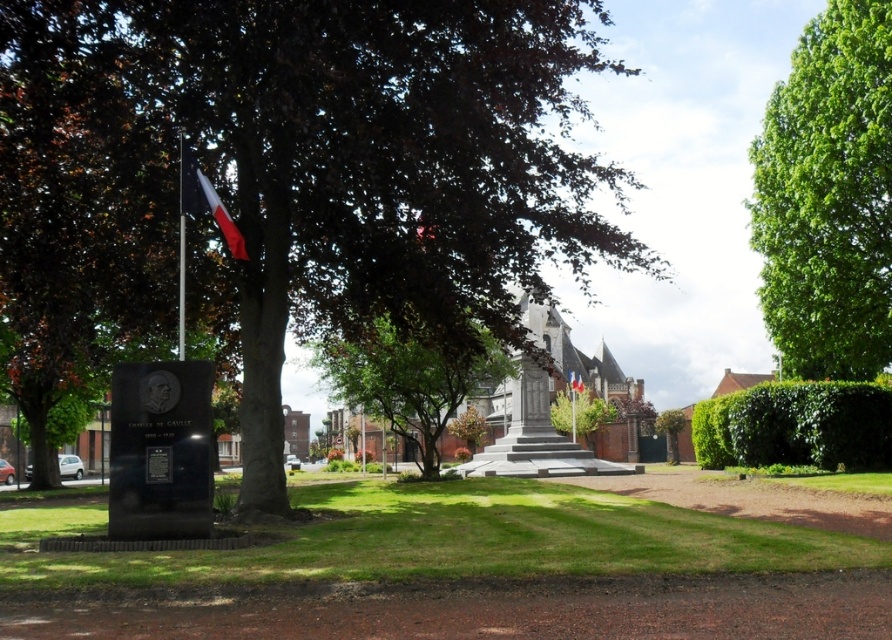
You are a park visitor who wants to take a photo of both the polished red flag at left and the red fabric flag at center. Which flag should you stand closer to in order to capture both in the same frame?

To capture both the polished red flag at left and the red fabric flag at center in the same frame, you should stand closer to the polished red flag at left since it is shorter than the red fabric flag at center, allowing you to include both within the camera view without excluding either due to height differences.

You are a photographer positioned in front of the black monument with a plaque. You want to capture both the polished red flag at left and the red fabric flag at center in your shot. Which flag is positioned closer to your current viewpoint?

The polished red flag at left is closer to the viewer than the red fabric flag at center, so it will appear closer in the photograph.